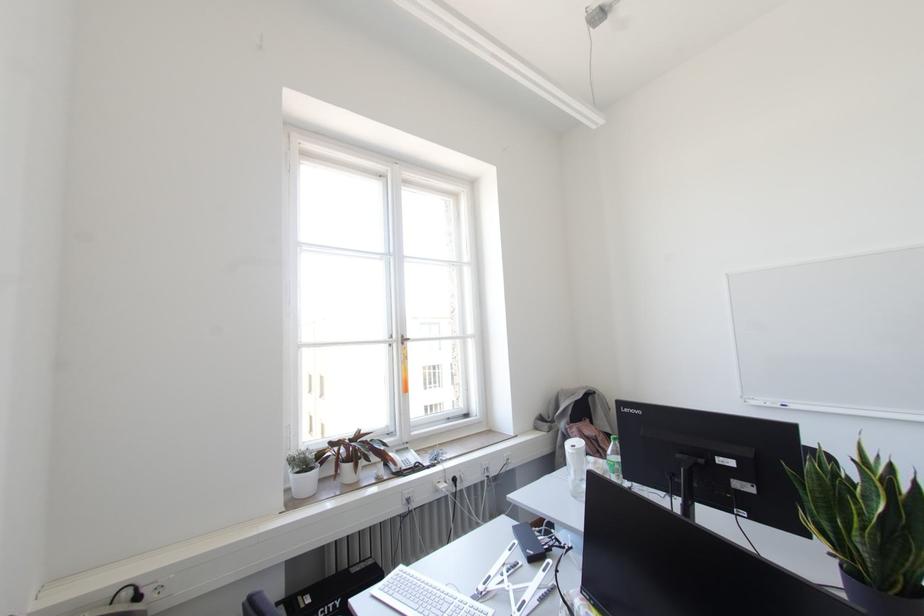
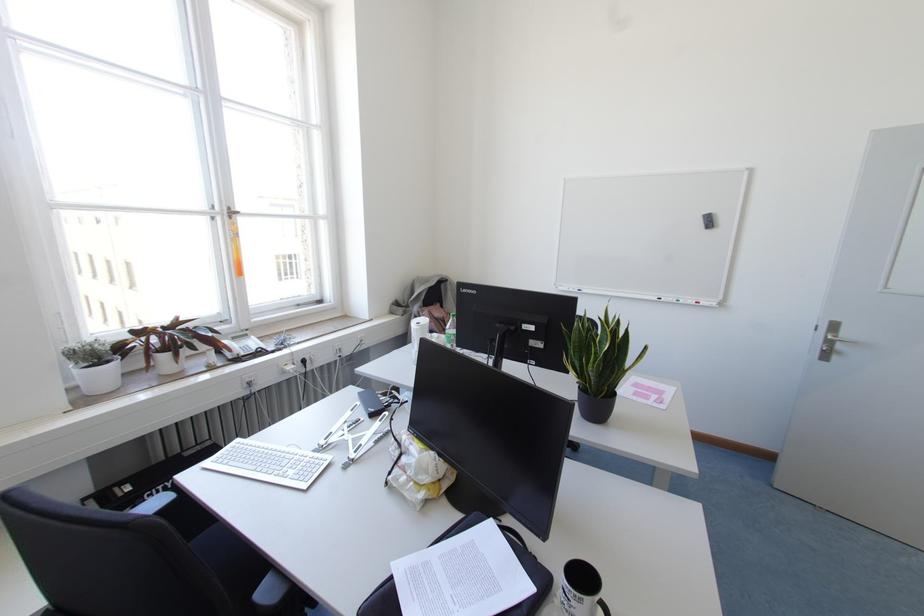
In the second image, find the point that corresponds to point (417, 464) in the first image.

(258, 349)